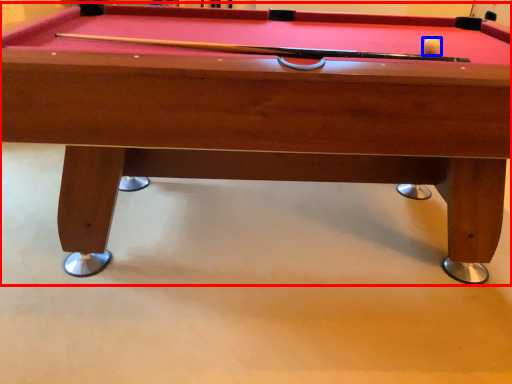
Question: Which of the following is the farthest to the observer, billiard table (highlighted by a red box) or ball (highlighted by a blue box)?

Choices:
 (A) billiard table
 (B) ball

Answer: (B)